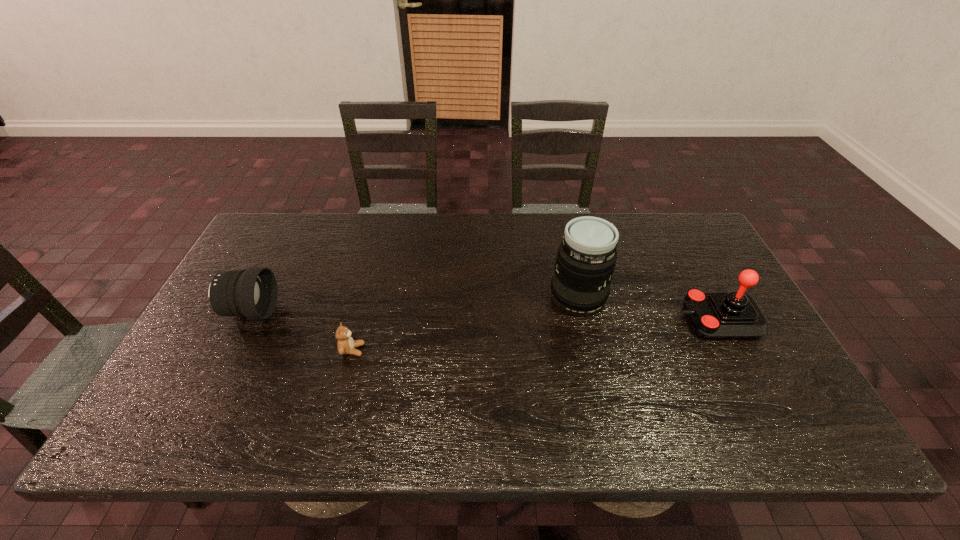
The image size is (960, 540). I want to click on vacant region between the leftmost object and the teddy bear, so click(x=301, y=331).

At what (x,y) coordinates should I click in order to perform the action: click on free space between the third tallest object and the shortest object. Please return your answer as a coordinate pair (x, y). This screenshot has width=960, height=540. Looking at the image, I should click on (301, 331).

Find the location of `vacant area between the second shortest object and the shortest object`. vacant area between the second shortest object and the shortest object is located at coordinates (301, 331).

Find the location of `vacant point located between the shorter telephoto lens and the tallest object`. vacant point located between the shorter telephoto lens and the tallest object is located at coordinates (414, 305).

Image resolution: width=960 pixels, height=540 pixels. What are the coordinates of `vacant space that is in between the shortest object and the tallest object` in the screenshot? It's located at (465, 324).

You are a GUI agent. You are given a task and a screenshot of the screen. Output one action in this format:
    pyautogui.click(x=<x>, y=<y>)
    Task: Click on the free spot between the shortest object and the shorter telephoto lens
    
    Given the screenshot: What is the action you would take?
    pyautogui.click(x=301, y=331)

Find the location of a particular element. Image resolution: width=960 pixels, height=540 pixels. free space that is in between the leftmost object and the second object from left to right is located at coordinates (301, 331).

The height and width of the screenshot is (540, 960). In order to click on vacant point located between the teddy bear and the second tallest object in this screenshot , I will do `click(535, 335)`.

At what (x,y) coordinates should I click in order to perform the action: click on free space between the rightmost object and the taller telephoto lens. Please return your answer as a coordinate pair (x, y). The height and width of the screenshot is (540, 960). Looking at the image, I should click on (648, 309).

Find the location of a particular element. The image size is (960, 540). unoccupied area between the rightmost object and the shorter telephoto lens is located at coordinates (484, 316).